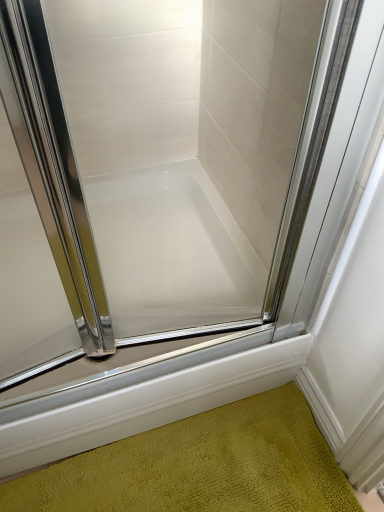
Question: Should I look upward or downward to see green textured bath mat at lower center?

Choices:
 (A) down
 (B) up

Answer: (A)